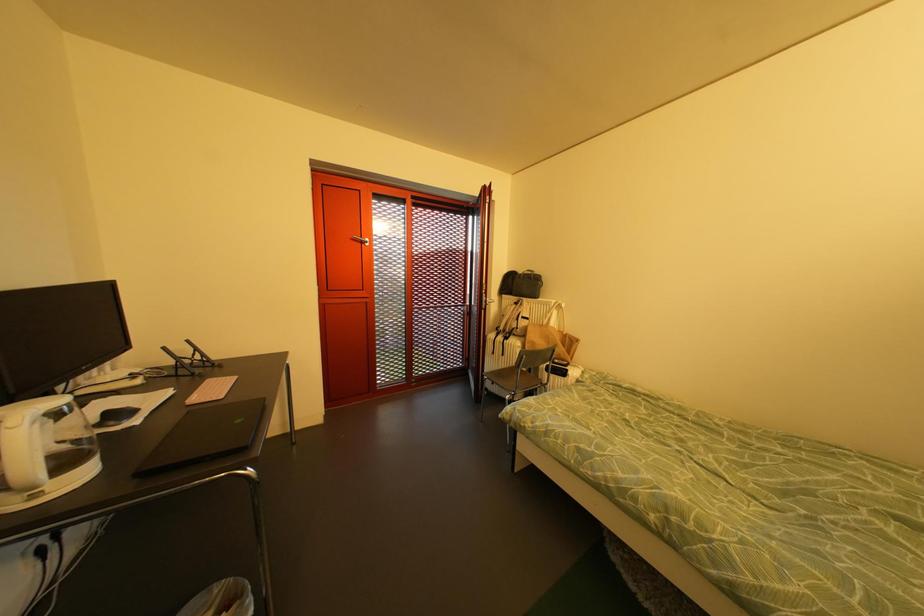
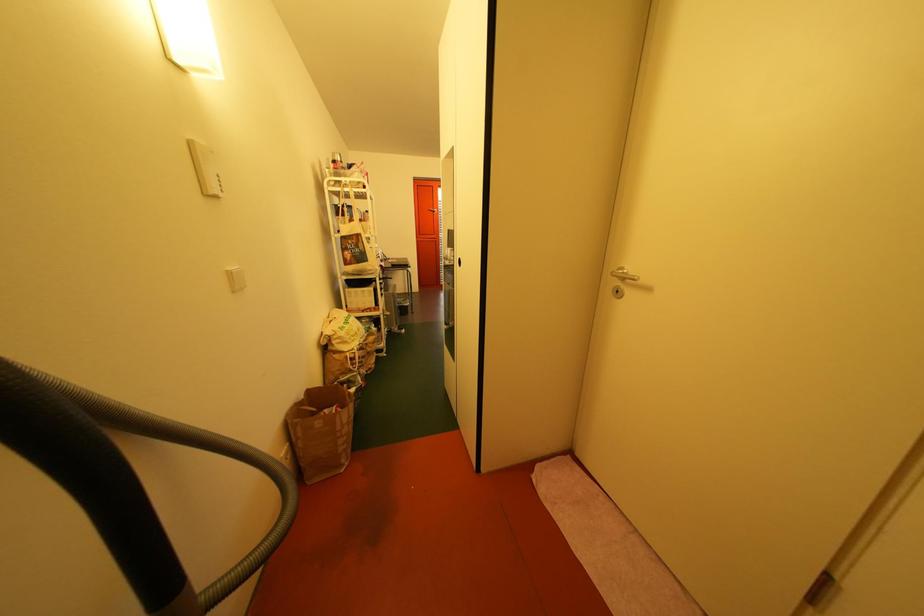
The images are taken continuously from a first-person perspective. In which direction are you moving?

The cameraman moved toward right, backward.